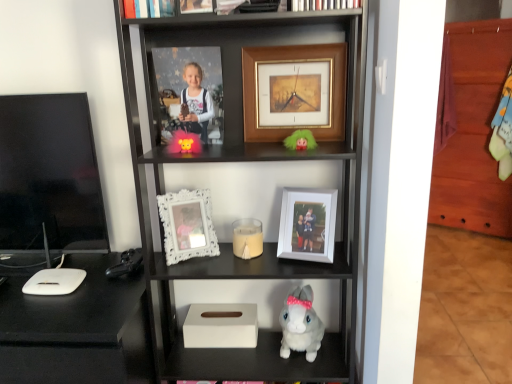
From the picture: How much space does white matte bookshelf at upper center, which appears as the 1th book when viewed from the right, occupy horizontally?

white matte bookshelf at upper center, which appears as the 1th book when viewed from the right, is 2.23 inches wide.

Where is `white matte bookshelf at upper center, which is counted as the second book, starting from the left`? white matte bookshelf at upper center, which is counted as the second book, starting from the left is located at coordinates (321, 4).

Describe the element at coordinates (221, 326) in the screenshot. The width and height of the screenshot is (512, 384). I see `white matte tissue box at lower center` at that location.

Measure the distance between point (149, 12) and camera.

Point (149, 12) is 1.07 meters away from camera.

Locate an element on the screen. white ornate picture frame at center, which ranks as the 4th picture frame in top-to-bottom order is located at coordinates (187, 225).

Where is `gold/gilded picture frame at upper center, which is the fourth picture frame in bottom-to-top order`? The image size is (512, 384). gold/gilded picture frame at upper center, which is the fourth picture frame in bottom-to-top order is located at coordinates (294, 91).

Locate an element on the screen. The width and height of the screenshot is (512, 384). matte plastic photo frame at upper center, marked as the third picture frame in a bottom-to-top arrangement is located at coordinates (191, 89).

How much space does matte plastic photo frame at upper center, marked as the third picture frame in a bottom-to-top arrangement, occupy vertically?

matte plastic photo frame at upper center, marked as the third picture frame in a bottom-to-top arrangement, is 12.13 inches tall.

The height and width of the screenshot is (384, 512). Identify the location of white matte bookshelf at upper center, which appears as the 1th book when viewed from the right. (321, 4).

Considering the sizes of white matte tissue box at lower center and white matte bookshelf at upper center, which appears as the 1th book when viewed from the right, in the image, is white matte tissue box at lower center taller or shorter than white matte bookshelf at upper center, which appears as the 1th book when viewed from the right,?

Clearly, white matte tissue box at lower center is taller compared to white matte bookshelf at upper center, which appears as the 1th book when viewed from the right.

Considering the relative positions of white matte tissue box at lower center and white matte bookshelf at upper center, which is counted as the second book, starting from the left, in the image provided, is white matte tissue box at lower center to the right of white matte bookshelf at upper center, which is counted as the second book, starting from the left, from the viewer's perspective?

No.

From a real-world perspective, between white matte tissue box at lower center and white matte bookshelf at upper center, which is counted as the second book, starting from the left, who is vertically lower?

white matte tissue box at lower center.

Does white matte tissue box at lower center lie in front of white matte bookshelf at upper center, which appears as the 1th book when viewed from the right?

That is True.

Is wooden photo frame at upper center, the first picture frame in the top-to-bottom sequence, thinner than white matte tissue box at lower center?

Indeed, wooden photo frame at upper center, the first picture frame in the top-to-bottom sequence, has a lesser width compared to white matte tissue box at lower center.

Is wooden photo frame at upper center, which is counted as the 5th picture frame, starting from the bottom, in contact with white matte tissue box at lower center?

No, wooden photo frame at upper center, which is counted as the 5th picture frame, starting from the bottom, is not next to white matte tissue box at lower center.

Who is bigger, wooden photo frame at upper center, which is counted as the 5th picture frame, starting from the bottom, or white matte tissue box at lower center?

white matte tissue box at lower center is bigger.

From a real-world perspective, is wooden photo frame at upper center, the first picture frame in the top-to-bottom sequence, above or below white matte tissue box at lower center?

From a real-world perspective, wooden photo frame at upper center, the first picture frame in the top-to-bottom sequence, is physically above white matte tissue box at lower center.

From the image's perspective, does shiny orange plush toy at center, placed as the second toy when sorted from back to front, appear lower than matte plastic photo frame at upper center, acting as the 3th picture frame starting from the top?

Indeed, from the image's perspective, shiny orange plush toy at center, placed as the second toy when sorted from back to front, is shown beneath matte plastic photo frame at upper center, acting as the 3th picture frame starting from the top.

From the picture: Could you tell me if shiny orange plush toy at center, which appears as the first toy when viewed from the front, is turned towards matte plastic photo frame at upper center, marked as the third picture frame in a bottom-to-top arrangement?

No, shiny orange plush toy at center, which appears as the first toy when viewed from the front, is not facing towards matte plastic photo frame at upper center, marked as the third picture frame in a bottom-to-top arrangement.

Would you say shiny orange plush toy at center, which appears as the first toy when viewed from the front, is inside or outside matte plastic photo frame at upper center, acting as the 3th picture frame starting from the top?

The correct answer is: outside.

Considering the sizes of objects shiny orange plush toy at center, marked as the 2th toy in a bottom-to-top arrangement, and matte plastic photo frame at upper center, marked as the third picture frame in a bottom-to-top arrangement, in the image provided, who is thinner, shiny orange plush toy at center, marked as the 2th toy in a bottom-to-top arrangement, or matte plastic photo frame at upper center, marked as the third picture frame in a bottom-to-top arrangement,?

matte plastic photo frame at upper center, marked as the third picture frame in a bottom-to-top arrangement, is thinner.

Which of these two, green fuzzy doll at upper center or white plush rabbit at lower center, arranged as the second toy when viewed from the top, is wider?

white plush rabbit at lower center, arranged as the second toy when viewed from the top, is wider.

Looking at this image, which is nearer, (296, 142) or (303, 345)?

Positioned in front is point (296, 142).

What's the angular difference between green fuzzy doll at upper center and white plush rabbit at lower center, arranged as the second toy when viewed from the top,'s facing directions?

They differ by 4.08 degrees in their facing directions.

Is green fuzzy doll at upper center to the left of wooden photo frame at upper center, the first picture frame in the top-to-bottom sequence, from the viewer's perspective?

In fact, green fuzzy doll at upper center is to the right of wooden photo frame at upper center, the first picture frame in the top-to-bottom sequence.

Are green fuzzy doll at upper center and wooden photo frame at upper center, which is counted as the 5th picture frame, starting from the bottom, making contact?

No, green fuzzy doll at upper center is not beside wooden photo frame at upper center, which is counted as the 5th picture frame, starting from the bottom.

Between green fuzzy doll at upper center and wooden photo frame at upper center, the first picture frame in the top-to-bottom sequence, which one has larger width?

green fuzzy doll at upper center is wider.

Looking at this image, considering the positions of objects green fuzzy doll at upper center and wooden photo frame at upper center, the first picture frame in the top-to-bottom sequence, in the image provided, who is behind, green fuzzy doll at upper center or wooden photo frame at upper center, the first picture frame in the top-to-bottom sequence,?

green fuzzy doll at upper center is behind.

Does white ornate picture frame at center, the 2th picture frame when ordered from bottom to top, have a smaller size compared to green fuzzy doll at upper center?

No.

Looking at this image, is white ornate picture frame at center, which ranks as the 4th picture frame in top-to-bottom order, positioned behind green fuzzy doll at upper center?

That is True.

At what (x,y) coordinates should I click in order to perform the action: click on doll that appears in front of the white ornate picture frame at center, the 2th picture frame when ordered from bottom to top. Please return your answer as a coordinate pair (x, y). The image size is (512, 384). Looking at the image, I should click on (300, 140).

In the scene shown: Can you confirm if green fuzzy doll at upper center is shorter than white matte candle at center?

No, green fuzzy doll at upper center is not shorter than white matte candle at center.

From a real-world perspective, is green fuzzy doll at upper center positioned over white matte candle at center based on gravity?

Yes, from a real-world perspective, green fuzzy doll at upper center is above white matte candle at center.

From the image's perspective, which is above, green fuzzy doll at upper center or white matte candle at center?

green fuzzy doll at upper center, from the image's perspective.

Is point (298, 139) more distant than point (246, 240)?

No, (298, 139) is closer to viewer.

Starting from the white matte tissue box at lower center, which book is the 1st one behind? Please provide its 2D coordinates.

[(321, 4)]

Where is `shelf lying in front of the wooden photo frame at upper center, the first picture frame in the top-to-bottom sequence`? shelf lying in front of the wooden photo frame at upper center, the first picture frame in the top-to-bottom sequence is located at coordinates (216, 194).

When comparing their distances from black matte desk at left, does white matte tissue box at lower center or shiny orange plush toy at center, placed as the first toy when sorted from left to right, seem closer?

Based on the image, white matte tissue box at lower center appears to be nearer to black matte desk at left.

When comparing their distances from matte plastic photo frame at upper center, marked as the third picture frame in a bottom-to-top arrangement, does white matte tissue box at lower center or black glossy tv at left seem further?

black glossy tv at left is positioned further to the anchor matte plastic photo frame at upper center, marked as the third picture frame in a bottom-to-top arrangement.

Looking at the image, which one is located further to white matte bookshelf at upper center, which is counted as the second book, starting from the left, wooden photo frame at upper center, the first picture frame in the top-to-bottom sequence, or matte plastic photo frame at upper center, marked as the third picture frame in a bottom-to-top arrangement?

matte plastic photo frame at upper center, marked as the third picture frame in a bottom-to-top arrangement, is positioned further to the anchor white matte bookshelf at upper center, which is counted as the second book, starting from the left.

Based on their spatial positions, is green fuzzy doll at upper center or white ornate picture frame at center, the 2th picture frame when ordered from bottom to top, closer to matte plastic photo frame at upper center, marked as the third picture frame in a bottom-to-top arrangement?

The object closer to matte plastic photo frame at upper center, marked as the third picture frame in a bottom-to-top arrangement, is white ornate picture frame at center, the 2th picture frame when ordered from bottom to top.

When comparing their distances from green fuzzy doll at upper center, does wooden photo frame at upper center, the first picture frame in the top-to-bottom sequence, or shiny orange plush toy at center, marked as the 2th toy in a bottom-to-top arrangement, seem further?

Among the two, wooden photo frame at upper center, the first picture frame in the top-to-bottom sequence, is located further to green fuzzy doll at upper center.

Which object lies nearer to the anchor point gold/gilded picture frame at upper center, which is the fourth picture frame in bottom-to-top order, white matte candle at center or white plush rabbit at lower center, positioned as the 1th toy in right-to-left order?

Among the two, white matte candle at center is located nearer to gold/gilded picture frame at upper center, which is the fourth picture frame in bottom-to-top order.

Considering their positions, is hardcover book at upper center, arranged as the first book when viewed from the left, positioned closer to wooden photo frame at upper center, which is counted as the 5th picture frame, starting from the bottom, than black glossy tv at left?

The object closer to wooden photo frame at upper center, which is counted as the 5th picture frame, starting from the bottom, is hardcover book at upper center, arranged as the first book when viewed from the left.

Consider the image. Based on their spatial positions, is green fuzzy doll at upper center or white matte bookshelf at upper center, which appears as the 1th book when viewed from the right, closer to black glossy tv at left?

The object closer to black glossy tv at left is green fuzzy doll at upper center.

What are the coordinates of `candle holder that lies between white matte picture frame at center, the 1th picture frame positioned from the bottom, and white matte tissue box at lower center from top to bottom` in the screenshot? It's located at (247, 238).

I want to click on candle holder between white matte bookshelf at upper center, which is counted as the second book, starting from the left, and black matte desk at left, in the vertical direction, so tap(247, 238).

Locate an element on the screen. This screenshot has width=512, height=384. toy located between black glossy tv at left and wooden photo frame at upper center, which is counted as the 5th picture frame, starting from the bottom, in the left-right direction is located at coordinates (184, 143).

Image resolution: width=512 pixels, height=384 pixels. I want to click on doll between white matte bookshelf at upper center, which appears as the 1th book when viewed from the right, and shiny orange plush toy at center, the first toy positioned from the top, in the up-down direction, so click(300, 140).